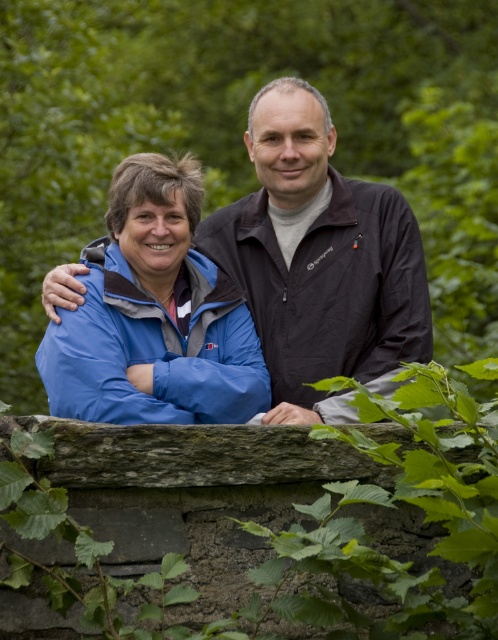
You are a photographer trying to capture a closeup of the blue fabric jacket at center. You notice a point at coordinates (x=320, y=260) in the image. Is this point likely to be a good location to focus on to get the blue fabric jacket at center in focus?

Yes, the point at (x=320, y=260) is where the blue fabric jacket at center is located, so focusing there would ensure the blue fabric jacket at center is in focus.